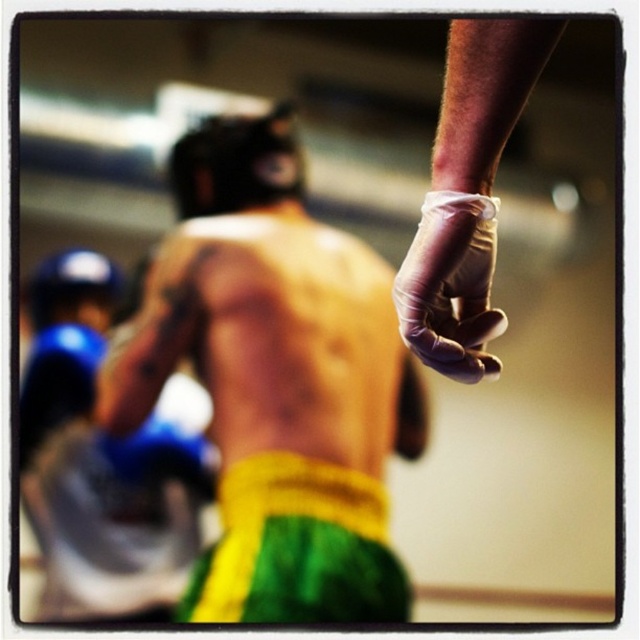
Is yellow-green shorts at center to the left of blue padded gloves at left from the viewer's perspective?

Incorrect, yellow-green shorts at center is not on the left side of blue padded gloves at left.

Is yellow-green shorts at center further to camera compared to blue padded gloves at left?

No, it is in front of blue padded gloves at left.

Is point (374, 481) farther from viewer compared to point (116, 604)?

Yes, it is.

This screenshot has height=640, width=640. Find the location of `yellow-green shorts at center`. yellow-green shorts at center is located at coordinates (275, 380).

Can you confirm if blue padded gloves at left is positioned to the right of purple latex glove at upper right?

In fact, blue padded gloves at left is to the left of purple latex glove at upper right.

Is blue padded gloves at left above purple latex glove at upper right?

Incorrect, blue padded gloves at left is not positioned above purple latex glove at upper right.

Which is in front, point (134, 500) or point (465, 243)?

Point (465, 243)

Locate an element on the screen. This screenshot has width=640, height=640. blue padded gloves at left is located at coordinates (100, 460).

Is yellow-green shorts at center wider than purple latex glove at upper right?

Yes.

Image resolution: width=640 pixels, height=640 pixels. Describe the element at coordinates (275, 380) in the screenshot. I see `yellow-green shorts at center` at that location.

Between point (320, 337) and point (460, 332), which one is positioned in front?

Positioned in front is point (460, 332).

Locate an element on the screen. The width and height of the screenshot is (640, 640). yellow-green shorts at center is located at coordinates (275, 380).